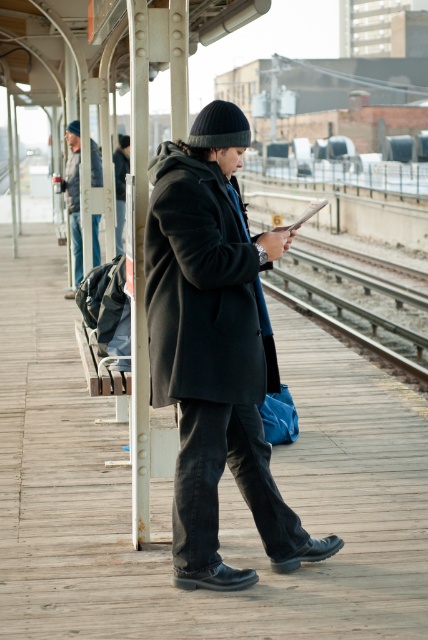
Is matte black coat at center below dark gray wool coat at center?

Correct, matte black coat at center is located below dark gray wool coat at center.

Who is higher up, matte black coat at center or dark gray wool coat at center?

dark gray wool coat at center is above.

Which is in front, point (160, 164) or point (128, 140)?

Point (160, 164) is in front.

You are a GUI agent. You are given a task and a screenshot of the screen. Output one action in this format:
    pyautogui.click(x=<x>, y=<y>)
    Task: Click on the matte black coat at center
    This screenshot has width=428, height=640.
    Given the screenshot: What is the action you would take?
    pyautogui.click(x=214, y=349)

Who is more forward, (x=395, y=355) or (x=122, y=196)?

Point (x=395, y=355) is in front.

Does metal train track at center have a smaller size compared to dark gray wool coat at center?

Indeed, metal train track at center has a smaller size compared to dark gray wool coat at center.

Image resolution: width=428 pixels, height=640 pixels. What do you see at coordinates (353, 328) in the screenshot? I see `metal train track at center` at bounding box center [353, 328].

Locate an element on the screen. metal train track at center is located at coordinates (353, 328).

Consider the image. Is black wool coat at center below metal train track at center?

Incorrect, black wool coat at center is not positioned below metal train track at center.

Who is positioned more to the left, black wool coat at center or metal train track at center?

black wool coat at center is more to the left.

Is point (163, 385) closer to camera compared to point (308, 308)?

Yes, point (163, 385) is in front of point (308, 308).

Identify the location of black wool coat at center. This screenshot has width=428, height=640. (201, 289).